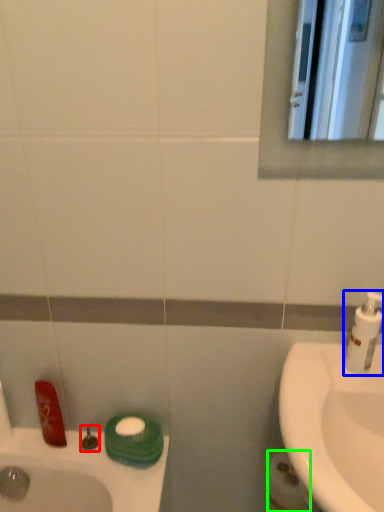
Question: Which object is positioned closest to plumbing fixture (highlighted by a red box)? Select from soap dispenser (highlighted by a blue box) and toilet paper (highlighted by a green box).

Choices:
 (A) soap dispenser
 (B) toilet paper

Answer: (B)